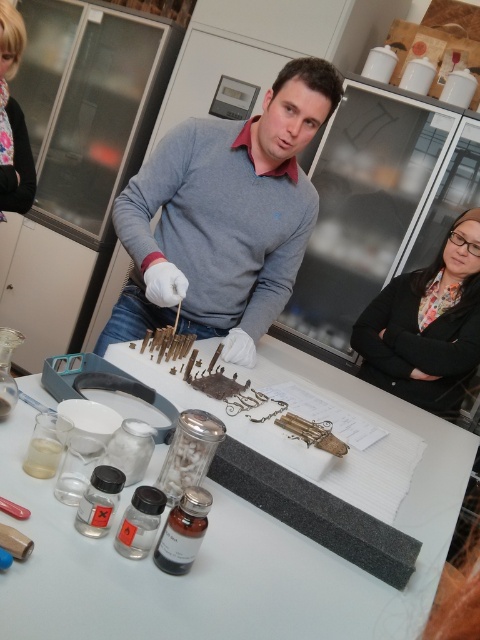
You are an observer in the laboratory scene. You need to locate the matte gray sweater at center. What are its coordinates on the image?

The coordinates of the matte gray sweater at center are at point (223, 218).

From the picture: You are a researcher in the lab and need to determine which of the two points, point [372,628] or point [9,205], is nearer to your current position. Based on the scene, which point is closer to you?

Point [372,628] is closer to the viewer than point [9,205], so the closer point is point [372,628].